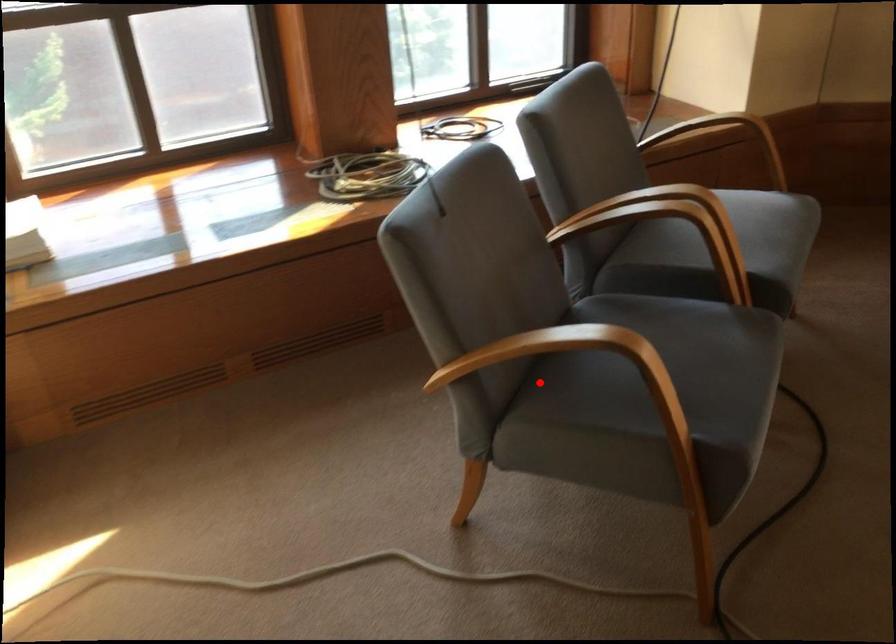
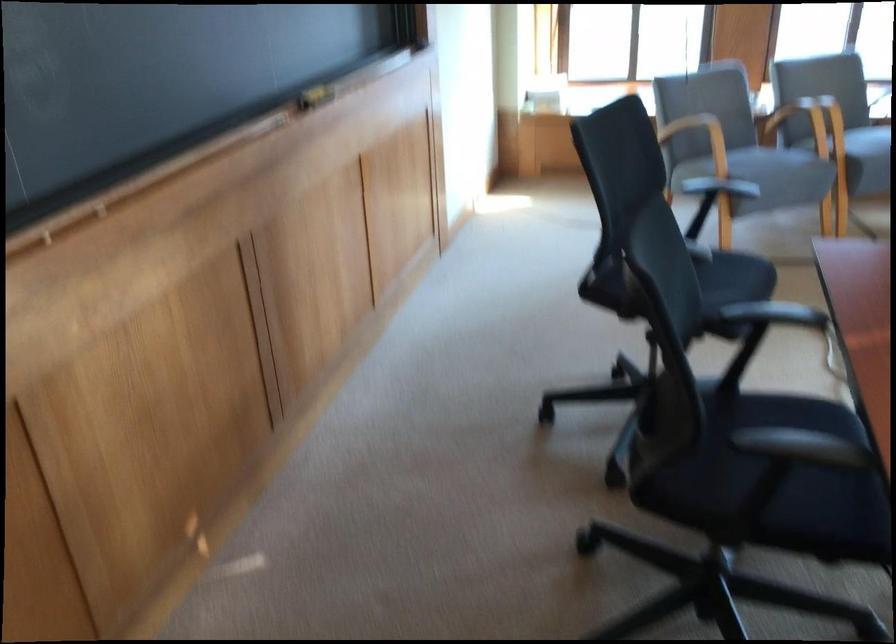
Find the pixel in the second image that matches the highlighted location in the first image.

(700, 138)